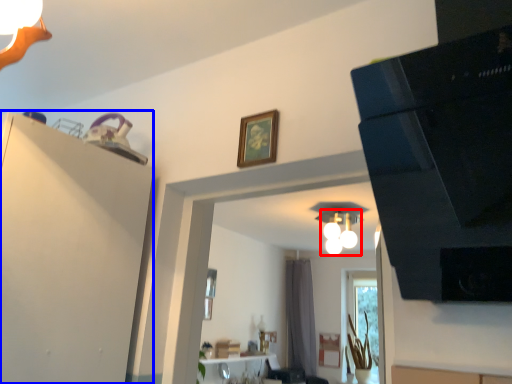
Question: Among these objects, which one is nearest to the camera, light fixture (highlighted by a red box) or dresser (highlighted by a blue box)?

Choices:
 (A) light fixture
 (B) dresser

Answer: (B)